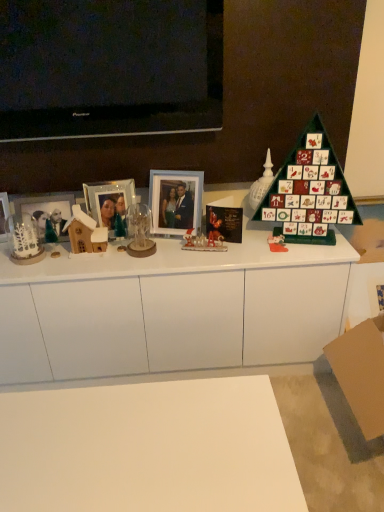
The image size is (384, 512). Find the location of `vacant region to the right of clear glass ornament at center, the fourth toy viewed from the right`. vacant region to the right of clear glass ornament at center, the fourth toy viewed from the right is located at coordinates (179, 250).